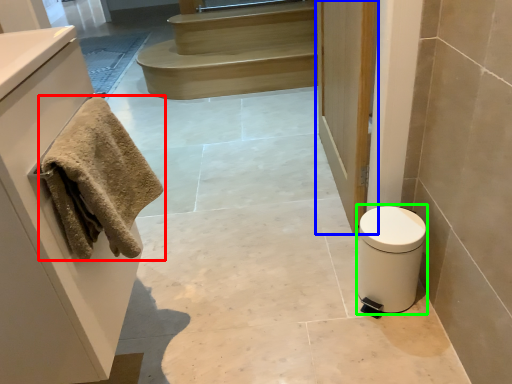
Question: Which object is the farthest from towel (highlighted by a red box)? Choose among these: door (highlighted by a blue box) or toilet bowl (highlighted by a green box).

Choices:
 (A) door
 (B) toilet bowl

Answer: (A)